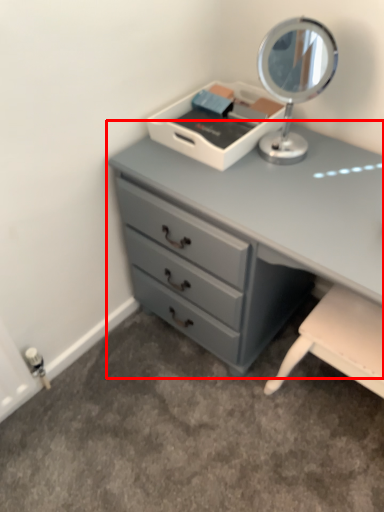
Question: Where is chest of drawers (annotated by the red box) located in relation to table lamp in the image?

Choices:
 (A) left
 (B) right

Answer: (B)